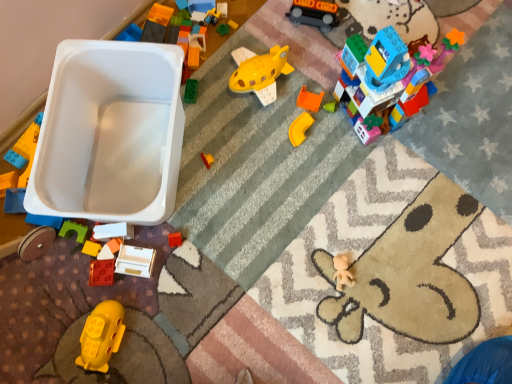
Image resolution: width=512 pixels, height=384 pixels. In order to click on free spot behind white matte block at lower left, arranged as the fifth toy when ordered from the bottom in this screenshot , I will do `click(124, 182)`.